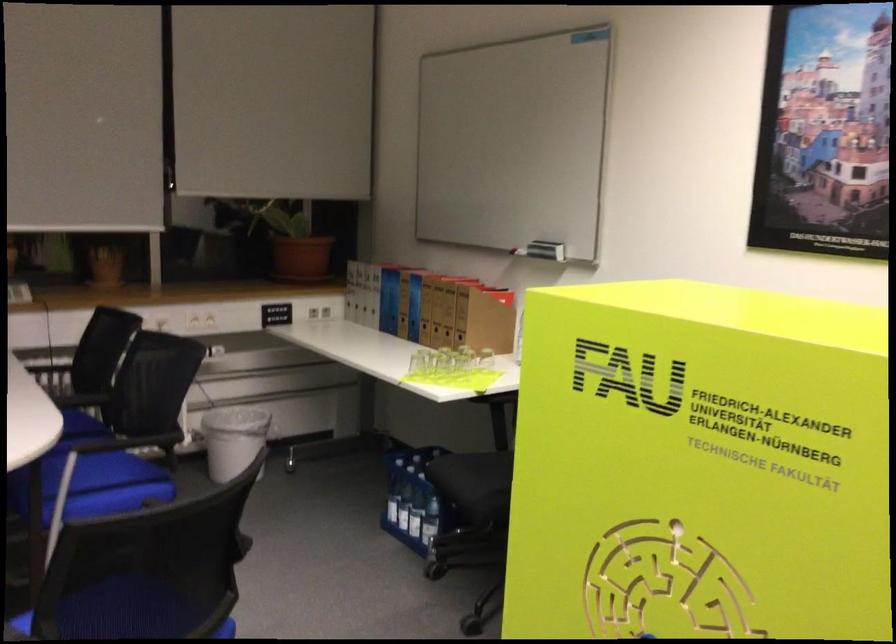
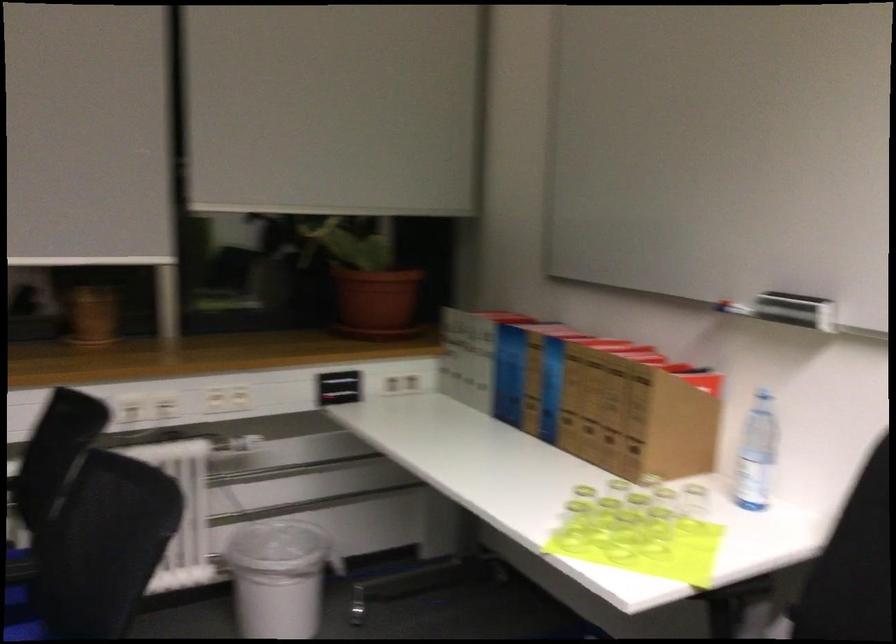
In the second image, find the point that corresponds to pixel 240 438 in the first image.

(278, 576)